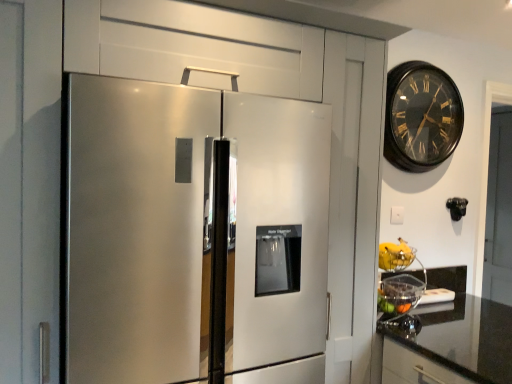
Question: Can you confirm if yellow matte bananas at right is positioned to the left of stainless steel refrigerator at left?

Choices:
 (A) yes
 (B) no

Answer: (B)

Question: Is yellow matte bananas at right not near stainless steel refrigerator at left?

Choices:
 (A) yes
 (B) no

Answer: (B)

Question: Can you confirm if yellow matte bananas at right is thinner than stainless steel refrigerator at left?

Choices:
 (A) yes
 (B) no

Answer: (A)

Question: Does yellow matte bananas at right touch stainless steel refrigerator at left?

Choices:
 (A) yes
 (B) no

Answer: (B)

Question: Is yellow matte bananas at right not within stainless steel refrigerator at left?

Choices:
 (A) yes
 (B) no

Answer: (A)

Question: From a real-world perspective, is black wooden clock at upper right positioned above or below stainless steel refrigerator at left?

Choices:
 (A) above
 (B) below

Answer: (A)

Question: In the image, is black wooden clock at upper right positioned in front of or behind stainless steel refrigerator at left?

Choices:
 (A) front
 (B) behind

Answer: (B)

Question: In terms of height, does black wooden clock at upper right look taller or shorter compared to stainless steel refrigerator at left?

Choices:
 (A) tall
 (B) short

Answer: (B)

Question: Is black wooden clock at upper right wider or thinner than stainless steel refrigerator at left?

Choices:
 (A) wide
 (B) thin

Answer: (B)

Question: Considering the positions of black granite countertop at lower right and stainless steel refrigerator at left in the image, is black granite countertop at lower right wider or thinner than stainless steel refrigerator at left?

Choices:
 (A) wide
 (B) thin

Answer: (A)

Question: From their relative heights in the image, would you say black granite countertop at lower right is taller or shorter than stainless steel refrigerator at left?

Choices:
 (A) short
 (B) tall

Answer: (A)

Question: Is black granite countertop at lower right in front of or behind stainless steel refrigerator at left in the image?

Choices:
 (A) front
 (B) behind

Answer: (B)

Question: Is black granite countertop at lower right spatially inside stainless steel refrigerator at left, or outside of it?

Choices:
 (A) inside
 (B) outside

Answer: (B)

Question: Considering the positions of point (99, 97) and point (414, 147), is point (99, 97) closer or farther from the camera than point (414, 147)?

Choices:
 (A) closer
 (B) farther

Answer: (A)

Question: Is stainless steel refrigerator at left wider or thinner than black wooden clock at upper right?

Choices:
 (A) wide
 (B) thin

Answer: (A)